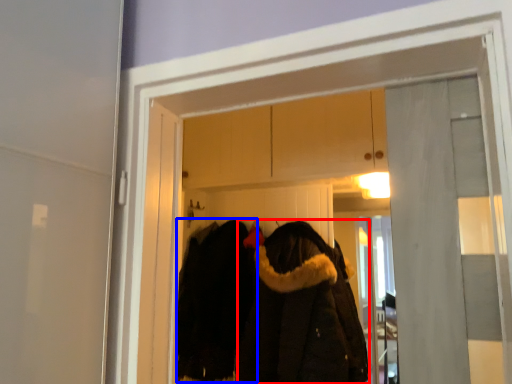
Question: Among these objects, which one is nearest to the camera, cloak (highlighted by a red box) or cloak (highlighted by a blue box)?

Choices:
 (A) cloak
 (B) cloak

Answer: (A)